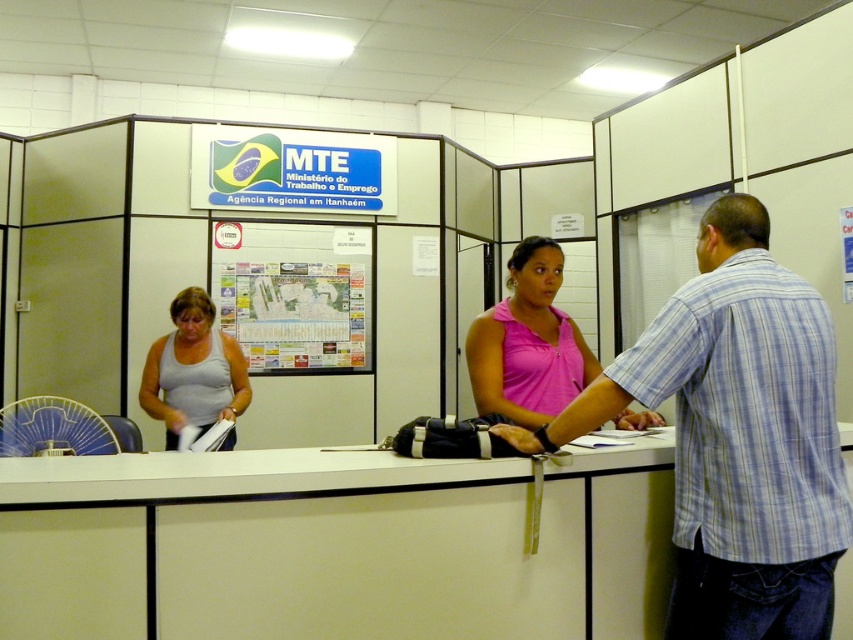
You are an office worker who needs to choose between the gray matte tank top at center and the clear plastic fan at left for a presentation. Which item is more suitable for demonstrating the concept of transparency?

The clear plastic fan at left is more suitable for demonstrating transparency because it is thicker than the gray matte tank top at center.

You are a visitor at the MTE office in Itanhaem. You see a plaid cotton shirt at center and a clear plastic fan at left. Which object is closer to you?

The plaid cotton shirt at center is closer to you because it is positioned over the clear plastic fan at left, indicating it is in front.